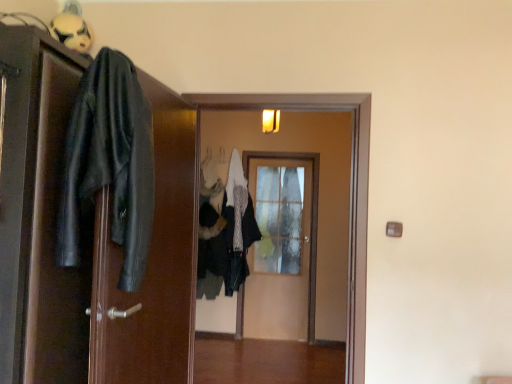
Question: Considering the relative positions of wooden door at center, which ranks as the 2th door in right-to-left order, and black leather jacket at left, which ranks as the first clothing in left-to-right order, in the image provided, is wooden door at center, which ranks as the 2th door in right-to-left order, to the right of black leather jacket at left, which ranks as the first clothing in left-to-right order, from the viewer's perspective?

Choices:
 (A) yes
 (B) no

Answer: (A)

Question: Can you confirm if wooden door at center, which ranks as the 2th door in right-to-left order, is smaller than black leather jacket at left, which ranks as the first clothing in left-to-right order?

Choices:
 (A) no
 (B) yes

Answer: (A)

Question: Is wooden door at center, the 2th door in the back-to-front sequence, aimed at black leather jacket at left, positioned as the 2th clothing in right-to-left order?

Choices:
 (A) no
 (B) yes

Answer: (B)

Question: Does wooden door at center, arranged as the 2th door when viewed from the left, have a lesser height compared to black leather jacket at left, the 1th clothing positioned from the front?

Choices:
 (A) no
 (B) yes

Answer: (A)

Question: Would you say black leather jacket at left, positioned as the 2th clothing in right-to-left order, is part of wooden door at center, which ranks as the 2th door in right-to-left order,'s contents?

Choices:
 (A) yes
 (B) no

Answer: (B)

Question: Considering the relative positions of wooden door at center, the 2th door in the back-to-front sequence, and black leather jacket at left, the 1th clothing positioned from the front, in the image provided, is wooden door at center, the 2th door in the back-to-front sequence, to the left of black leather jacket at left, the 1th clothing positioned from the front, from the viewer's perspective?

Choices:
 (A) yes
 (B) no

Answer: (B)

Question: Is black leather jacket at left, positioned as the 2th clothing in right-to-left order, turned away from white textured coat at center, which is the 2th clothing in front-to-back order?

Choices:
 (A) no
 (B) yes

Answer: (A)

Question: From a real-world perspective, is black leather jacket at left, the 1th clothing positioned from the front, on top of white textured coat at center, the 1th clothing when ordered from back to front?

Choices:
 (A) yes
 (B) no

Answer: (A)

Question: Is black leather jacket at left, which ranks as the first clothing in left-to-right order, located outside white textured coat at center, which is the second clothing in left-to-right order?

Choices:
 (A) no
 (B) yes

Answer: (B)

Question: Is black leather jacket at left, which is the 2th clothing in back-to-front order, directly adjacent to white textured coat at center, which is the second clothing in left-to-right order?

Choices:
 (A) yes
 (B) no

Answer: (B)

Question: Considering the relative positions of black leather jacket at left, which is the 2th clothing in back-to-front order, and white textured coat at center, which appears as the 1th clothing when viewed from the right, in the image provided, is black leather jacket at left, which is the 2th clothing in back-to-front order, to the right of white textured coat at center, which appears as the 1th clothing when viewed from the right, from the viewer's perspective?

Choices:
 (A) no
 (B) yes

Answer: (A)

Question: Is black leather jacket at left, which is the 2th clothing in back-to-front order, positioned far away from white textured coat at center, which appears as the 1th clothing when viewed from the right?

Choices:
 (A) no
 (B) yes

Answer: (B)

Question: Is white matte mask at upper left smaller than black leather jacket at left, the first door from the front?

Choices:
 (A) yes
 (B) no

Answer: (A)